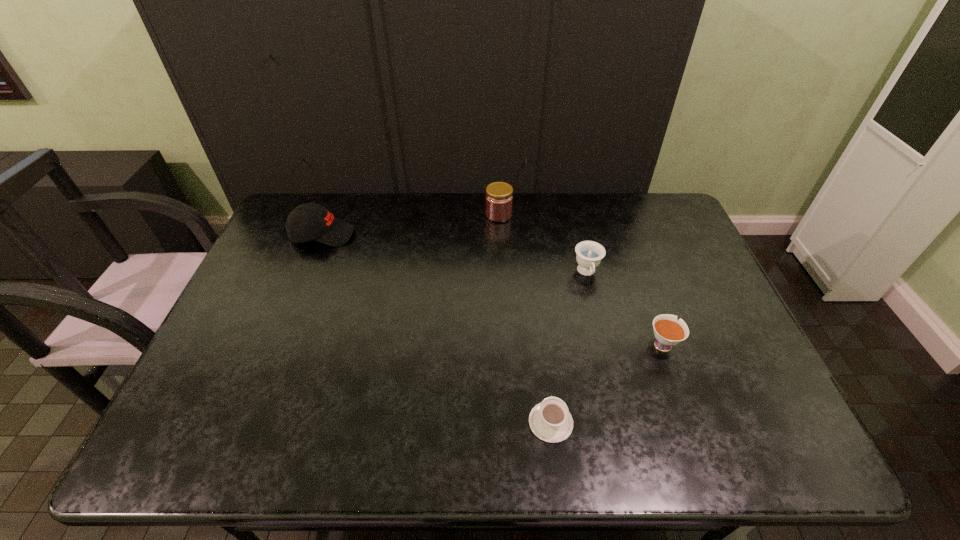
You are a GUI agent. You are given a task and a screenshot of the screen. Output one action in this format:
    pyautogui.click(x=<x>, y=<y>)
    Task: Click on the vacant region between the second teacup from right to left and the baseball cap
    The height and width of the screenshot is (540, 960).
    Given the screenshot: What is the action you would take?
    pyautogui.click(x=455, y=254)

I want to click on free point between the leftmost teacup and the rightmost object, so [607, 383].

I want to click on vacant point located between the baseball cap and the second teacup from right to left, so click(455, 254).

Identify the location of free area in between the baseball cap and the jam. (411, 225).

Find the location of a particular element. free space between the rightmost teacup and the baseball cap is located at coordinates (492, 289).

You are a GUI agent. You are given a task and a screenshot of the screen. Output one action in this format:
    pyautogui.click(x=<x>, y=<y>)
    Task: Click on the free space between the second teacup from left to right and the shortest teacup
    
    Given the screenshot: What is the action you would take?
    pyautogui.click(x=569, y=348)

At what (x,y) coordinates should I click in order to perform the action: click on free space between the nearest teacup and the rightmost teacup. Please return your answer as a coordinate pair (x, y). The image size is (960, 540). Looking at the image, I should click on (607, 383).

Point out which object is positioned as the fourth nearest to the jam. Please provide its 2D coordinates. Your answer should be formatted as a tuple, i.e. [(x, y)], where the tuple contains the x and y coordinates of a point satisfying the conditions above.

[(550, 420)]

Where is `object that stands as the third closest to the leftmost object`? This screenshot has width=960, height=540. object that stands as the third closest to the leftmost object is located at coordinates (550, 420).

Select which teacup appears as the closest to the shortest object. Please provide its 2D coordinates. Your answer should be formatted as a tuple, i.e. [(x, y)], where the tuple contains the x and y coordinates of a point satisfying the conditions above.

[(668, 332)]